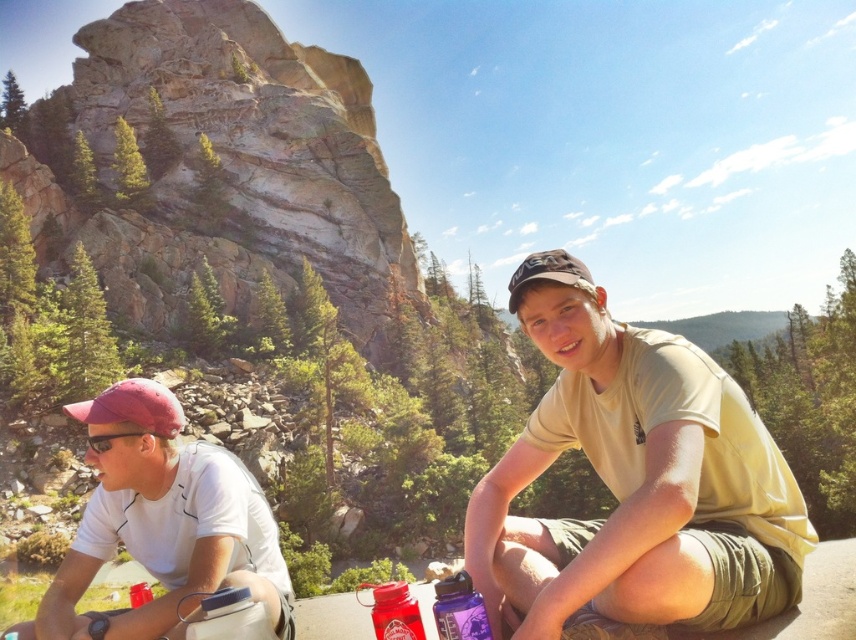
Question: Which point is closer to the camera taking this photo?

Choices:
 (A) click(449, 605)
 (B) click(669, 540)
 (C) click(357, 586)
 (D) click(218, 108)

Answer: (B)

Question: Does rustic stone mountain at upper left appear under shiny red plastic bottle at lower center?

Choices:
 (A) no
 (B) yes

Answer: (A)

Question: Considering the relative positions of white matte shirt at left and shiny red plastic bottle at lower center in the image provided, where is white matte shirt at left located with respect to shiny red plastic bottle at lower center?

Choices:
 (A) above
 (B) below

Answer: (A)

Question: Among these objects, which one is nearest to the camera?

Choices:
 (A) white matte shirt at left
 (B) purple matte water bottle at lower center
 (C) rustic stone mountain at upper left

Answer: (A)

Question: Which of the following is the farthest from the observer?

Choices:
 (A) (390, 627)
 (B) (111, 33)
 (C) (471, 612)
 (D) (134, 636)

Answer: (B)

Question: Does tan cotton shirt at center appear under shiny red plastic bottle at lower center?

Choices:
 (A) no
 (B) yes

Answer: (A)